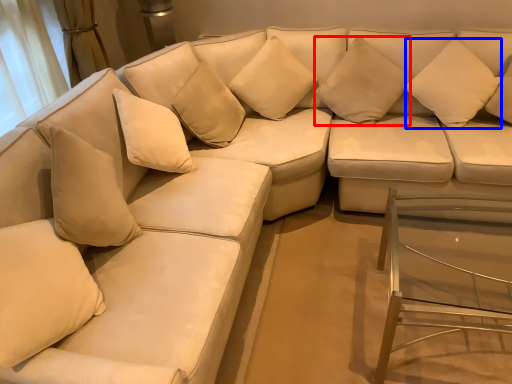
Question: Which point is further to the camera, pillow (highlighted by a red box) or pillow (highlighted by a blue box)?

Choices:
 (A) pillow
 (B) pillow

Answer: (A)